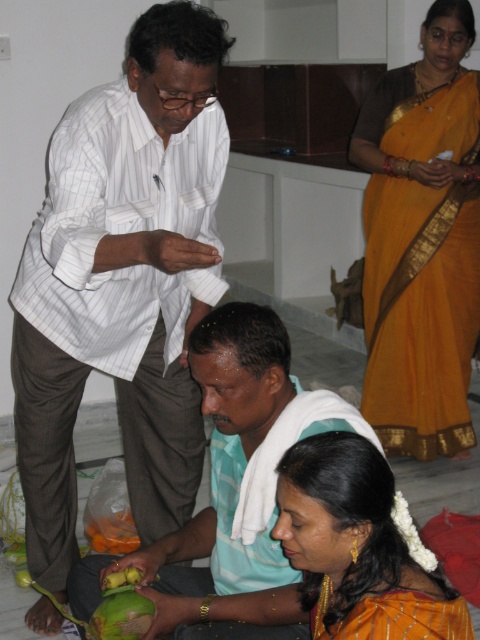
You are standing in the kitchen and need to locate the white striped shirt at upper left and the yellow silk saree at lower right. Which object is positioned higher in the image?

The white striped shirt at upper left is positioned higher than the yellow silk saree at lower right.

You are a delivery robot that is 1.2 meters tall. You need to deliver a package to the kitchen counter behind the green matte mango at lower left. Can you see the counter from your current position? Explain why or why not.

The green matte mango at lower left and camera are 1.45 meters apart. Since the robot is 1.2 meters tall, it is shorter than the distance to the mango, so it might not be able to see over it to the kitchen counter behind. However, the exact visibility depends on the mango and any other obstacles between the robot and the counter.

You are a delivery robot with a 40 cm wide package. You need to move from the entrance to the kitchen counter, which is near the white striped shirt at upper left. There is a green matte coconut at lower center blocking the path. Can you pass through the space between them?

The distance between the white striped shirt at upper left and the green matte coconut at lower center is 46.59 centimeters. Since your package is 40 cm wide, you can pass through the space between them as the distance is wider than the package.